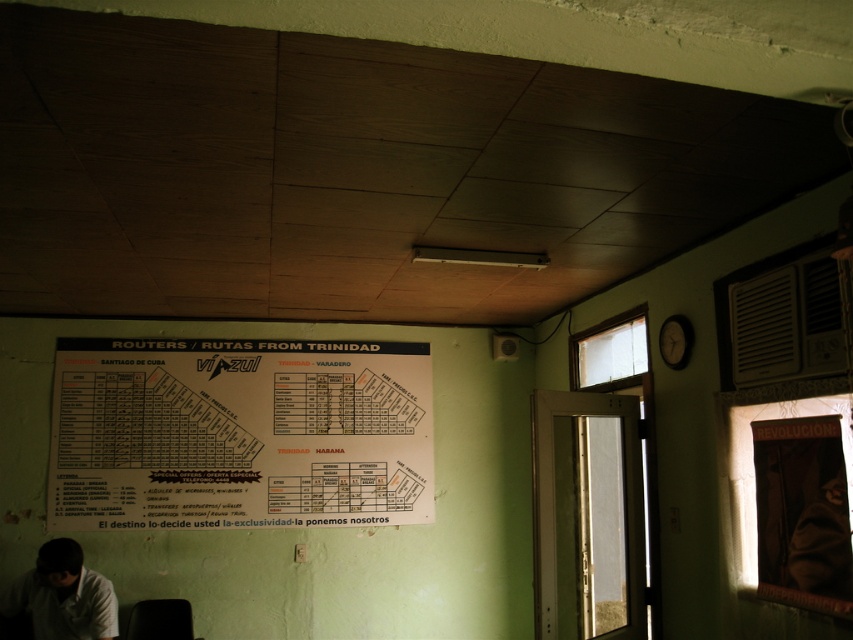
You are standing in the room and want to read the white paper poster at center without moving your head. Can you also see the white matte shirt at lower left in your field of view?

The white paper poster at center is 38.10 inches away from the white matte shirt at lower left. Since both are in the same room and the distance is moderate, you can likely see both without moving your head.

You are standing in the room and want to read the white paper poster at center and the white matte shirt at lower left. Which object is located to the right of the other?

The white paper poster at center is positioned on the right side of white matte shirt at lower left.

You are a traveler looking at the white paper poster at center and the white matte shirt at lower left. Which object is closer to you?

The white paper poster at center is closer to you because it is positioned over the white matte shirt at lower left, indicating it is in front.